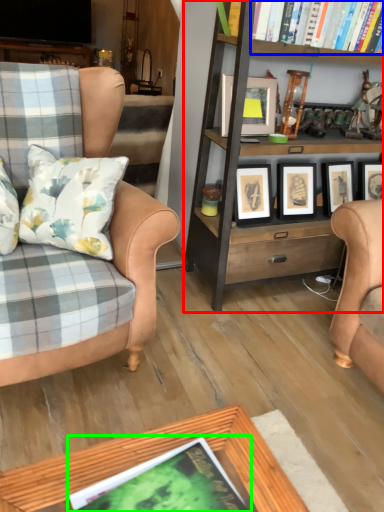
Question: Which object is positioned closest to bookcase (highlighted by a red box)? Select from book (highlighted by a blue box) and book (highlighted by a green box).

Choices:
 (A) book
 (B) book

Answer: (A)